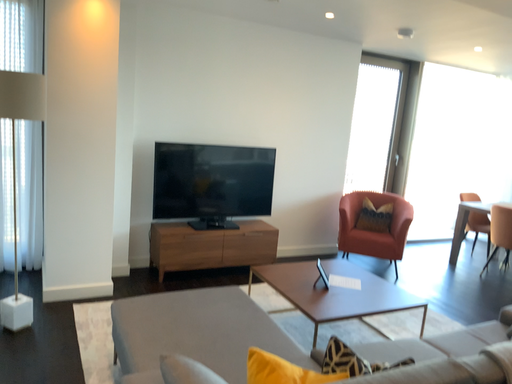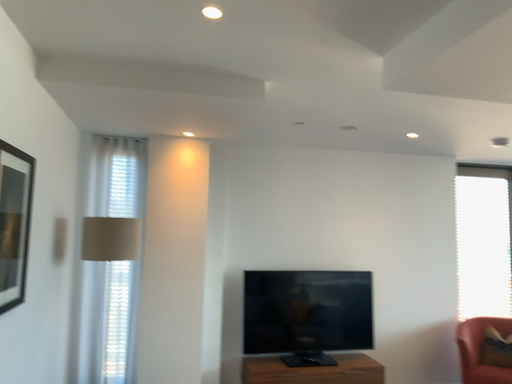
Question: Which way did the camera rotate in the video?

Choices:
 (A) rotated downward
 (B) rotated upward

Answer: (B)